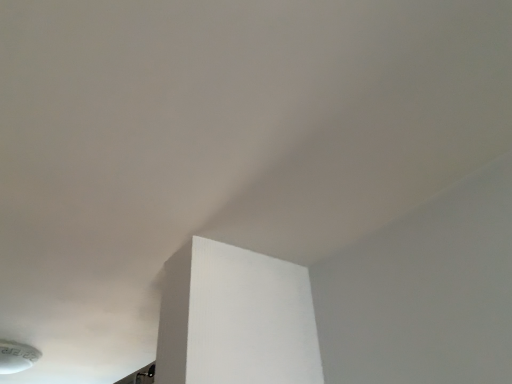
Describe the element at coordinates (17, 356) in the screenshot. The height and width of the screenshot is (384, 512). I see `white plastic smoke detector at lower left` at that location.

Locate an element on the screen. The width and height of the screenshot is (512, 384). white plastic smoke detector at lower left is located at coordinates (17, 356).

Find the location of a particular element. The image size is (512, 384). white plastic smoke detector at lower left is located at coordinates (17, 356).